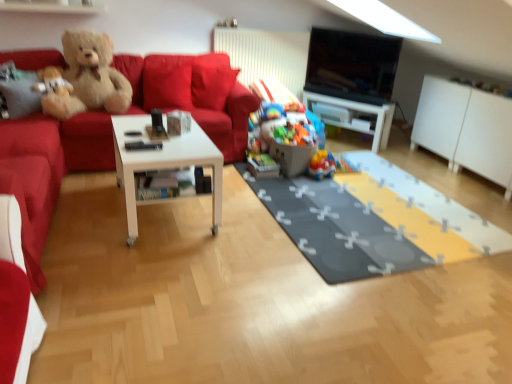
At what (x,y) coordinates should I click in order to perform the action: click on vacant space to the left of white glossy coffee table at center. Please return your answer as a coordinate pair (x, y). Looking at the image, I should click on (94, 199).